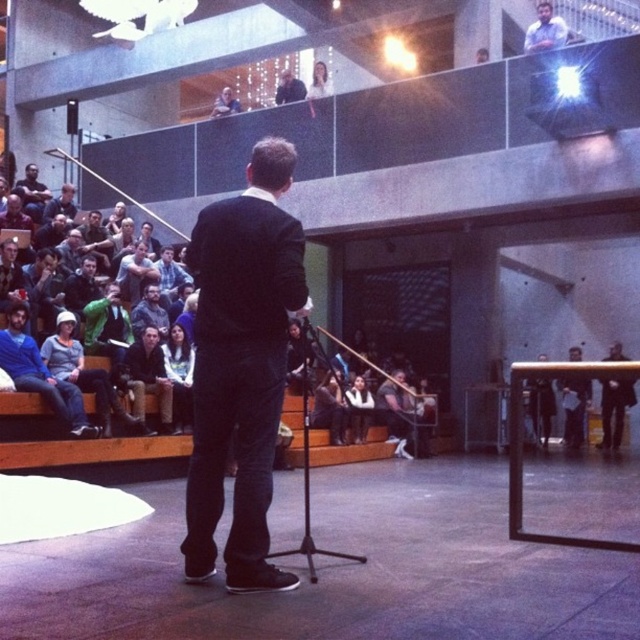
Question: Does dark gray fabric seats at left have a smaller size compared to light blue shirt at upper right?

Choices:
 (A) yes
 (B) no

Answer: (A)

Question: Which object is farther from the camera taking this photo?

Choices:
 (A) light blue shirt at upper right
 (B) dark gray fabric seats at left

Answer: (A)

Question: Can you confirm if black matte suit at center is wider than light blue shirt at upper right?

Choices:
 (A) yes
 (B) no

Answer: (A)

Question: Which point is closer to the camera taking this photo?

Choices:
 (A) (296, 97)
 (B) (321, 458)
 (C) (534, 51)

Answer: (B)

Question: Can you confirm if light blue shirt at upper right is positioned below dark blue jeans at center?

Choices:
 (A) no
 (B) yes

Answer: (A)

Question: Among these points, which one is farthest from the camera?

Choices:
 (A) (292, 83)
 (B) (548, 29)

Answer: (A)